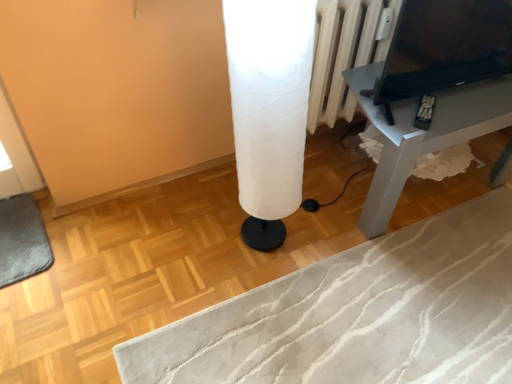
Describe the element at coordinates (445, 47) in the screenshot. I see `black glossy tv at upper right` at that location.

Where is `matte gray table at right`? matte gray table at right is located at coordinates (423, 134).

The width and height of the screenshot is (512, 384). What do you see at coordinates (269, 108) in the screenshot? I see `white fabric lampshade at center` at bounding box center [269, 108].

Identify the location of black glossy tv at upper right. The image size is (512, 384). (445, 47).

Is black glossy tv at upper right facing away from matte gray table at right?

black glossy tv at upper right is not turned away from matte gray table at right.

Between black glossy tv at upper right and matte gray table at right, which one has smaller size?

Smaller between the two is black glossy tv at upper right.

Do you think black glossy tv at upper right is within matte gray table at right, or outside of it?

black glossy tv at upper right exists outside the volume of matte gray table at right.

Are black glossy tv at upper right and matte gray table at right far apart?

No, black glossy tv at upper right is in close proximity to matte gray table at right.

From a real-world perspective, who is located higher, black glossy tv at upper right or white fabric lampshade at center?

From a 3D spatial view, black glossy tv at upper right is above.

Is point (400, 11) closer or farther from the camera than point (267, 36)?

Point (400, 11) is farther from the camera than point (267, 36).

Does black glossy tv at upper right lie behind white fabric lampshade at center?

Yes, it is.

Is black glossy tv at upper right not within white fabric lampshade at center?

That's correct, black glossy tv at upper right is outside of white fabric lampshade at center.

Is white fabric lampshade at center in contact with matte gray table at right?

No, white fabric lampshade at center is not beside matte gray table at right.

Considering the positions of objects white fabric lampshade at center and matte gray table at right in the image provided, who is more to the left, white fabric lampshade at center or matte gray table at right?

From the viewer's perspective, white fabric lampshade at center appears more on the left side.

Considering the positions of points (234, 39) and (451, 105), is point (234, 39) closer to camera compared to point (451, 105)?

Yes, point (234, 39) is in front of point (451, 105).

How much distance is there between white fabric lampshade at center and matte gray table at right?

white fabric lampshade at center is 19.25 inches away from matte gray table at right.

Can you confirm if white fabric lampshade at center is taller than black glossy tv at upper right?

Yes.

Is the position of white fabric lampshade at center less distant than that of black glossy tv at upper right?

Yes, white fabric lampshade at center is in front of black glossy tv at upper right.

Where is `computer on the right of white fabric lampshade at center`? computer on the right of white fabric lampshade at center is located at coordinates (445, 47).

Considering the positions of objects matte gray table at right and white fabric lampshade at center in the image provided, who is in front, matte gray table at right or white fabric lampshade at center?

white fabric lampshade at center is closer to the camera.

Based on the photo, is white fabric lampshade at center located within matte gray table at right?

No, white fabric lampshade at center is not surrounded by matte gray table at right.

Which is in front, point (386, 204) or point (248, 64)?

The point (248, 64) is closer to the camera.

Considering the sizes of objects matte gray table at right and white fabric lampshade at center in the image provided, who is taller, matte gray table at right or white fabric lampshade at center?

white fabric lampshade at center is taller.

From the picture: How distant is matte gray table at right from black glossy tv at upper right?

6.83 inches.

Which object is further away from the camera, matte gray table at right or black glossy tv at upper right?

Positioned behind is matte gray table at right.

Looking at their sizes, would you say matte gray table at right is wider or thinner than black glossy tv at upper right?

Considering their sizes, matte gray table at right looks broader than black glossy tv at upper right.

From the image's perspective, between matte gray table at right and black glossy tv at upper right, who is located below?

matte gray table at right appears lower in the image.

In the image, there is a black glossy tv at upper right. In order to click on table below it (from the image's perspective) in this screenshot , I will do `click(423, 134)`.

Identify the location of computer located behind the white fabric lampshade at center. (445, 47).

From the picture: Considering their positions, is white fabric lampshade at center positioned closer to black glossy tv at upper right than matte gray table at right?

Based on the image, matte gray table at right appears to be nearer to black glossy tv at upper right.

Based on the photo, looking at the image, which one is located further to white fabric lampshade at center, matte gray table at right or black glossy tv at upper right?

black glossy tv at upper right lies further to white fabric lampshade at center than the other object.

Based on their spatial positions, is black glossy tv at upper right or white fabric lampshade at center closer to matte gray table at right?

black glossy tv at upper right is closer to matte gray table at right.

Estimate the real-world distances between objects in this image. Which object is closer to black glossy tv at upper right, matte gray table at right or white fabric lampshade at center?

Based on the image, matte gray table at right appears to be nearer to black glossy tv at upper right.

Looking at the image, which one is located further to matte gray table at right, white fabric lampshade at center or black glossy tv at upper right?

Among the two, white fabric lampshade at center is located further to matte gray table at right.

Considering their positions, is black glossy tv at upper right positioned further to white fabric lampshade at center than matte gray table at right?

black glossy tv at upper right lies further to white fabric lampshade at center than the other object.

Where is `table between white fabric lampshade at center and black glossy tv at upper right in the horizontal direction`? Image resolution: width=512 pixels, height=384 pixels. table between white fabric lampshade at center and black glossy tv at upper right in the horizontal direction is located at coordinates (423, 134).